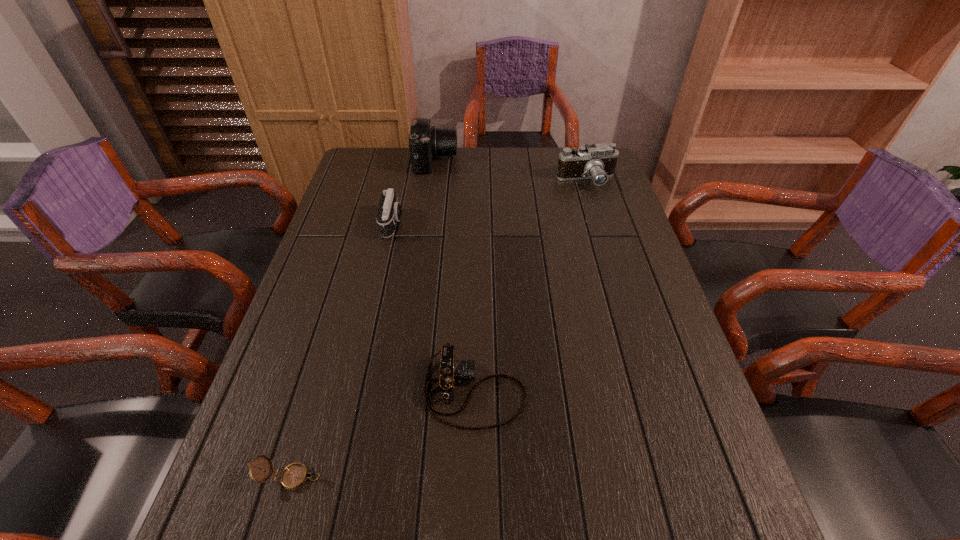
This screenshot has width=960, height=540. In order to click on the tallest camera in this screenshot , I will do tap(426, 142).

I want to click on the rightmost object, so tap(597, 162).

This screenshot has height=540, width=960. In order to click on the third farthest object in this screenshot , I will do `click(389, 212)`.

Find the location of a particular element. the nearest camera is located at coordinates (451, 370).

Locate an element on the screen. the shortest camera is located at coordinates (451, 370).

Where is `compass`? The height and width of the screenshot is (540, 960). compass is located at coordinates (294, 476).

At what (x,y) coordinates should I click in order to perform the action: click on free space located on the lens of the tallest object. Please return your answer as a coordinate pair (x, y). This screenshot has width=960, height=540. Looking at the image, I should click on (522, 160).

Locate an element on the screen. This screenshot has height=540, width=960. vacant space located at the lens of the rightmost object is located at coordinates (612, 265).

Where is `free location located 0.120m on the front lens of the third nearest object`? free location located 0.120m on the front lens of the third nearest object is located at coordinates (443, 224).

At what (x,y) coordinates should I click in order to perform the action: click on free location located on the front-facing side of the nearest camera. Please return your answer as a coordinate pair (x, y). This screenshot has width=960, height=540. Looking at the image, I should click on coord(554,390).